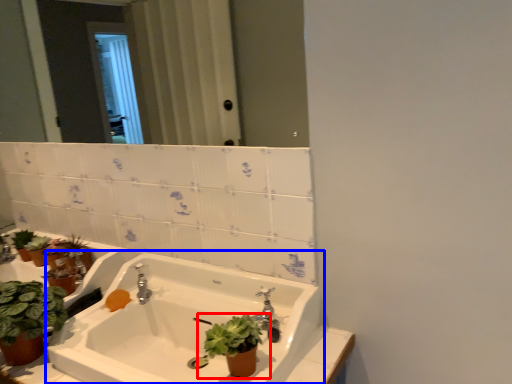
Question: Which point is further to the camera, houseplant (highlighted by a red box) or sink (highlighted by a blue box)?

Choices:
 (A) houseplant
 (B) sink

Answer: (A)